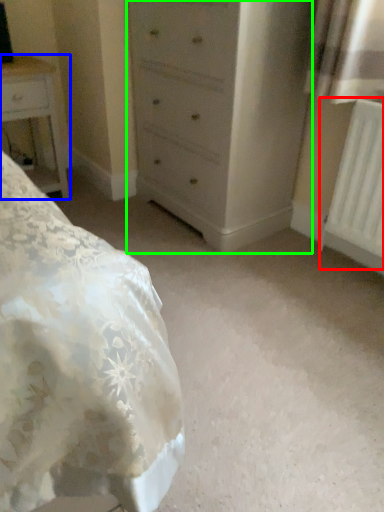
Question: Based on their relative distances, which object is nearer to radiator (highlighted by a red box)? Choose from nightstand (highlighted by a blue box) and chest of drawers (highlighted by a green box).

Choices:
 (A) nightstand
 (B) chest of drawers

Answer: (B)